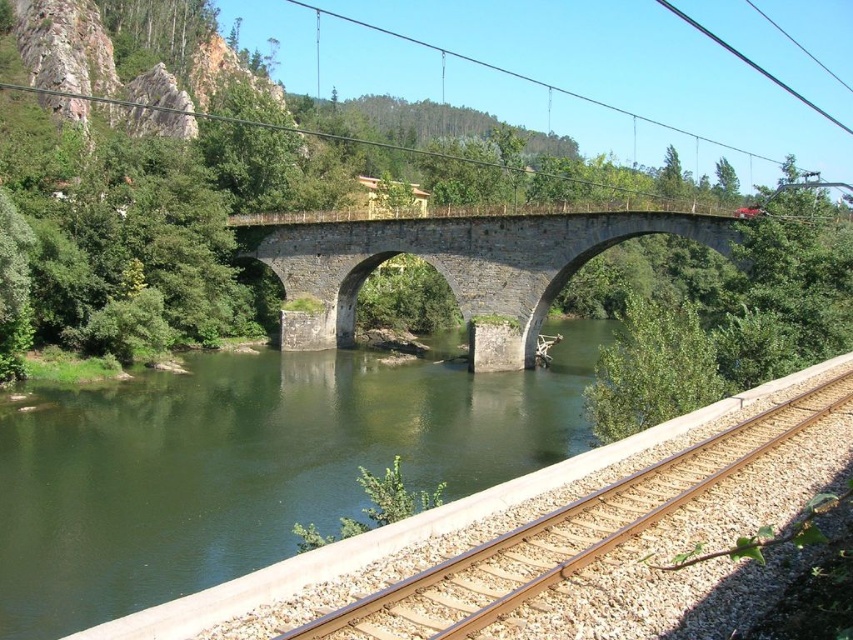
Does point (321, 308) come closer to viewer compared to point (438, 564)?

No, it is not.

Between stone arch bridge at center and brown gravel track at lower right, which one has less height?

brown gravel track at lower right

This screenshot has height=640, width=853. In order to click on stone arch bridge at center in this screenshot , I will do `click(454, 268)`.

In the scene shown: Does green stone river at center appear over brown gravel track at lower right?

No.

Does green stone river at center have a greater height compared to brown gravel track at lower right?

Correct, green stone river at center is much taller as brown gravel track at lower right.

Where is `green stone river at center`? This screenshot has width=853, height=640. green stone river at center is located at coordinates (248, 465).

Who is taller, green stone river at center or stone arch bridge at center?

stone arch bridge at center

Based on the photo, is green stone river at center closer to camera compared to stone arch bridge at center?

Yes, it is in front of stone arch bridge at center.

Locate an element on the screen. This screenshot has height=640, width=853. green stone river at center is located at coordinates (248, 465).